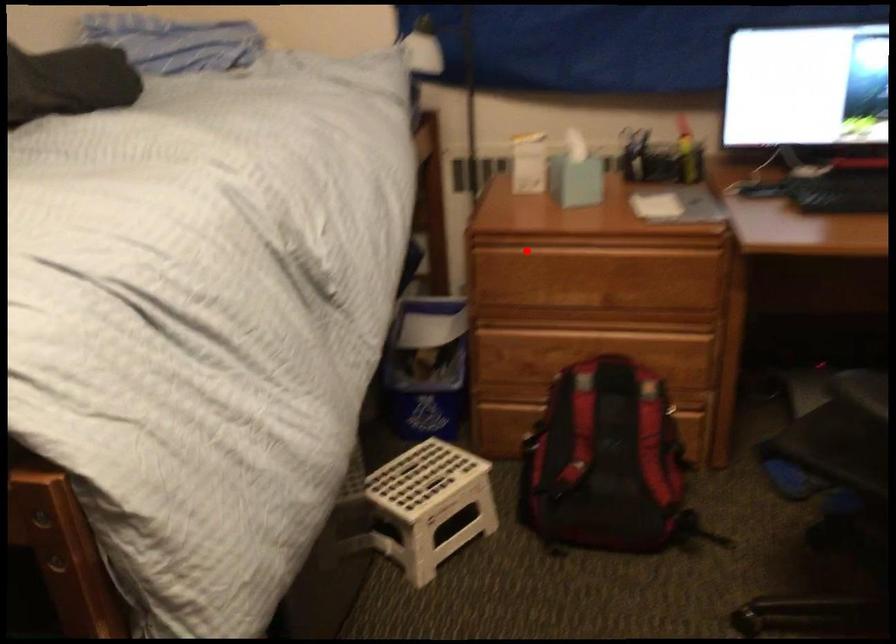
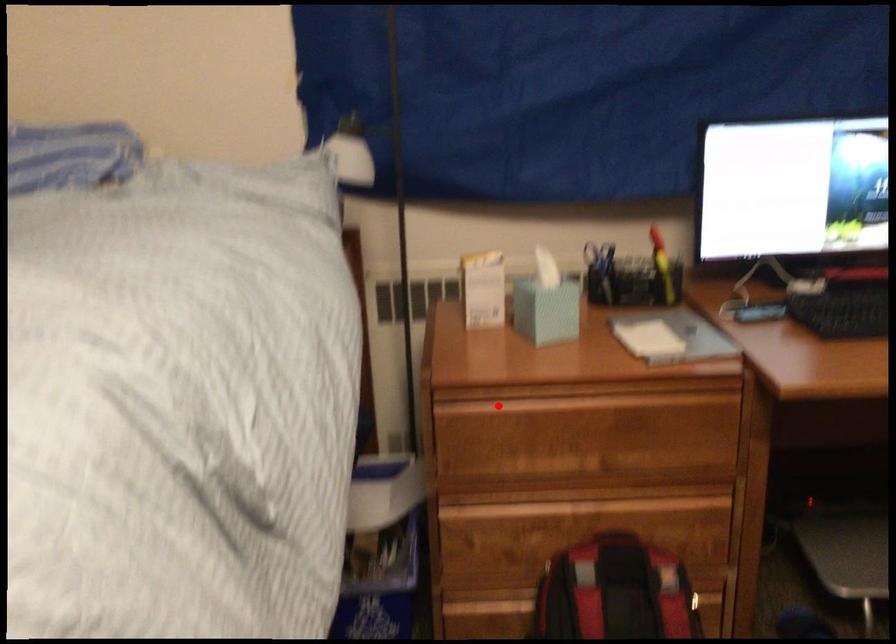
I am providing you with two images of the same scene from different viewpoints. A red point is marked on the first image and another point is marked on the second image. Is the red point in image1 aligned with the point shown in image2?

Yes